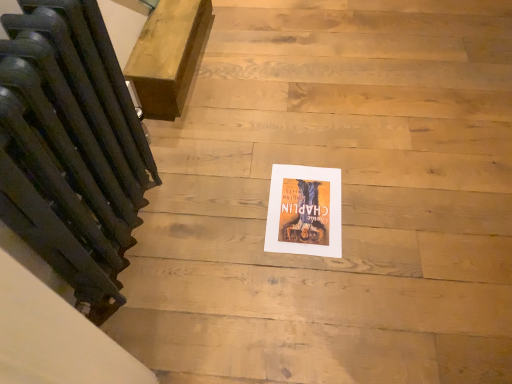
Question: Does matte paper poster at center have a larger size compared to matte black radiator at left?

Choices:
 (A) yes
 (B) no

Answer: (B)

Question: From the image's perspective, is matte paper poster at center below matte black radiator at left?

Choices:
 (A) no
 (B) yes

Answer: (B)

Question: Is matte paper poster at center at the right side of matte black radiator at left?

Choices:
 (A) no
 (B) yes

Answer: (B)

Question: Considering the relative sizes of matte paper poster at center and matte black radiator at left in the image provided, is matte paper poster at center thinner than matte black radiator at left?

Choices:
 (A) yes
 (B) no

Answer: (B)

Question: Is matte paper poster at center next to matte black radiator at left and touching it?

Choices:
 (A) no
 (B) yes

Answer: (A)

Question: Is wooden bench at upper left wider or thinner than matte paper poster at center?

Choices:
 (A) wide
 (B) thin

Answer: (A)

Question: In the image, is wooden bench at upper left on the left side or the right side of matte paper poster at center?

Choices:
 (A) right
 (B) left

Answer: (B)

Question: Relative to matte paper poster at center, is wooden bench at upper left in front or behind?

Choices:
 (A) behind
 (B) front

Answer: (A)

Question: From a real-world perspective, is wooden bench at upper left positioned above or below matte paper poster at center?

Choices:
 (A) above
 (B) below

Answer: (A)

Question: Considering the positions of matte paper poster at center and wooden bench at upper left in the image, is matte paper poster at center bigger or smaller than wooden bench at upper left?

Choices:
 (A) small
 (B) big

Answer: (A)

Question: From a real-world perspective, is matte paper poster at center above or below wooden bench at upper left?

Choices:
 (A) below
 (B) above

Answer: (A)

Question: From the image's perspective, is matte paper poster at center positioned above or below wooden bench at upper left?

Choices:
 (A) above
 (B) below

Answer: (B)

Question: Is matte paper poster at center taller or shorter than wooden bench at upper left?

Choices:
 (A) short
 (B) tall

Answer: (A)

Question: From a real-world perspective, is matte paper poster at center positioned above or below matte black radiator at left?

Choices:
 (A) above
 (B) below

Answer: (B)

Question: Considering the positions of point (333, 182) and point (29, 8), is point (333, 182) closer or farther from the camera than point (29, 8)?

Choices:
 (A) farther
 (B) closer

Answer: (A)